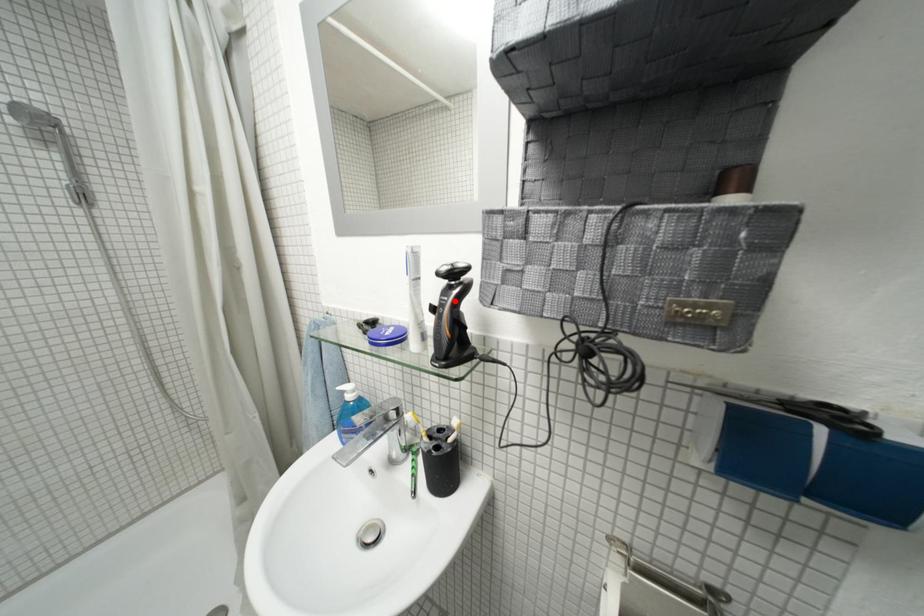
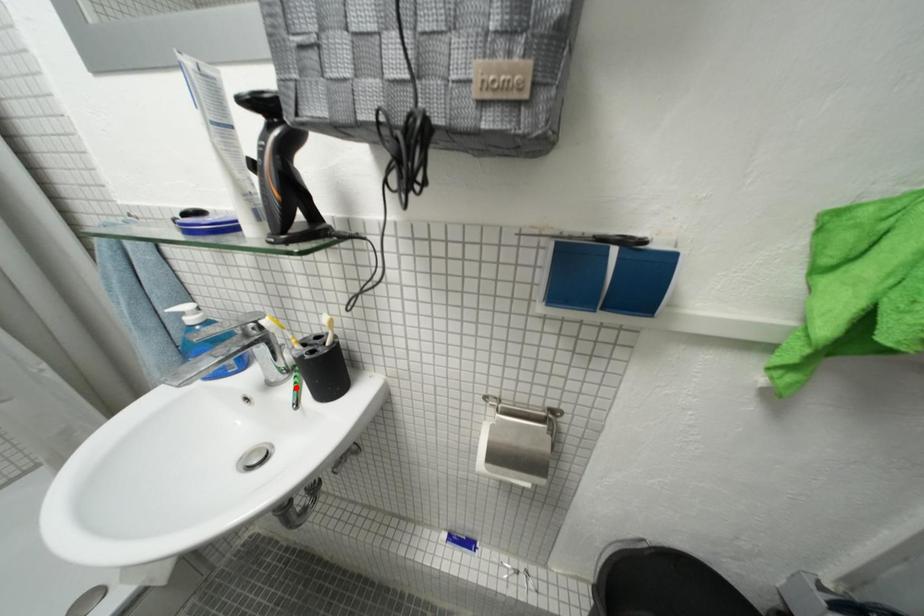
I am providing you with two images of the same scene from different viewpoints. A red point is marked on the first image and another point is marked on the second image. Is the red point in image1 aligned with the point shown in image2?

No